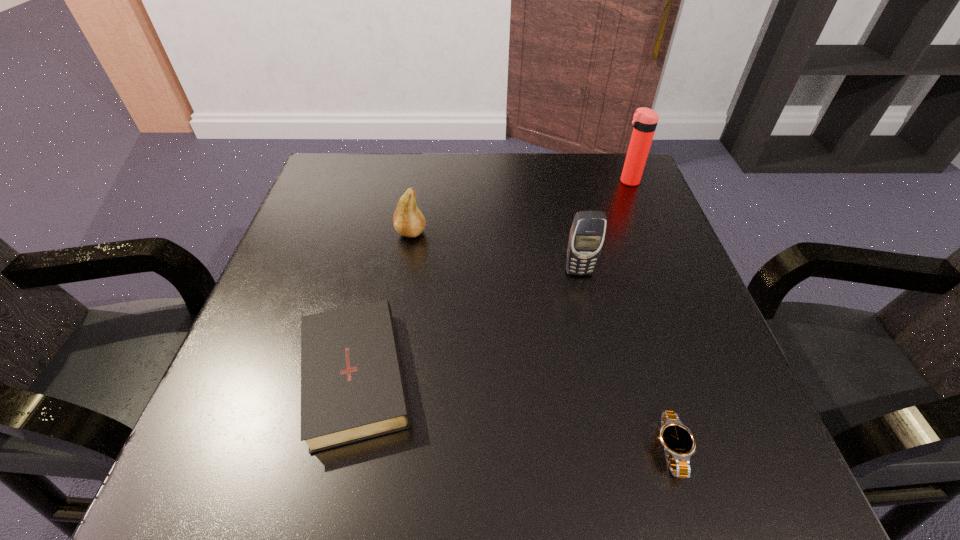
The height and width of the screenshot is (540, 960). I want to click on free space located on the front face of the cellular telephone, so click(591, 329).

Identify the location of vacant space situated on the right of the third tallest object. (599, 233).

This screenshot has height=540, width=960. I want to click on vacant space located on the back of the Bible, so [x=381, y=264].

In order to click on blank area located on the left of the watch in this screenshot , I will do `click(418, 449)`.

The height and width of the screenshot is (540, 960). I want to click on object that is positioned at the far edge, so pos(645,120).

Find the location of `Bible present at the near edge`. Bible present at the near edge is located at coordinates (352, 387).

I want to click on watch that is at the near edge, so click(x=679, y=443).

The image size is (960, 540). What are the coordinates of `object positioned at the left edge` in the screenshot? It's located at (352, 387).

The image size is (960, 540). Find the location of `thermos bottle that is at the right edge`. thermos bottle that is at the right edge is located at coordinates (645, 120).

At what (x,y) coordinates should I click in order to perform the action: click on watch that is at the right edge. Please return your answer as a coordinate pair (x, y). Looking at the image, I should click on (679, 443).